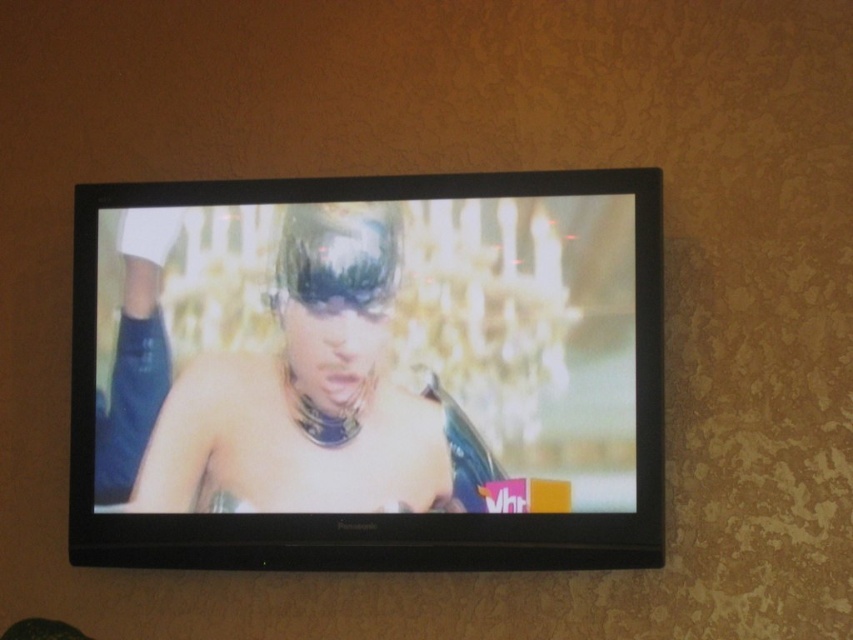
You are a camera operator filming a scene. The camera is set up 6.10 feet away from the black glossy tv at center. The director wants to zoom in on the TV screen to focus on the person in the music video. Is the current distance sufficient to capture clear facial details of the person on the TV?

The camera is 6.10 feet away from the black glossy tv at center. This distance may be sufficient if the camera has a high zoom capability, but typically, being this close could cause blurring or difficulty focusing on distant details like facial features. It depends on the camera equipment used.

You are standing in front of the black glossy tv at center and want to touch the shiny black hair at center. Can you reach it without moving the TV?

The black glossy tv at center is to the right of the shiny black hair at center, but since the shiny black hair is part of the TV screen display, you cannot physically touch it without moving the TV.